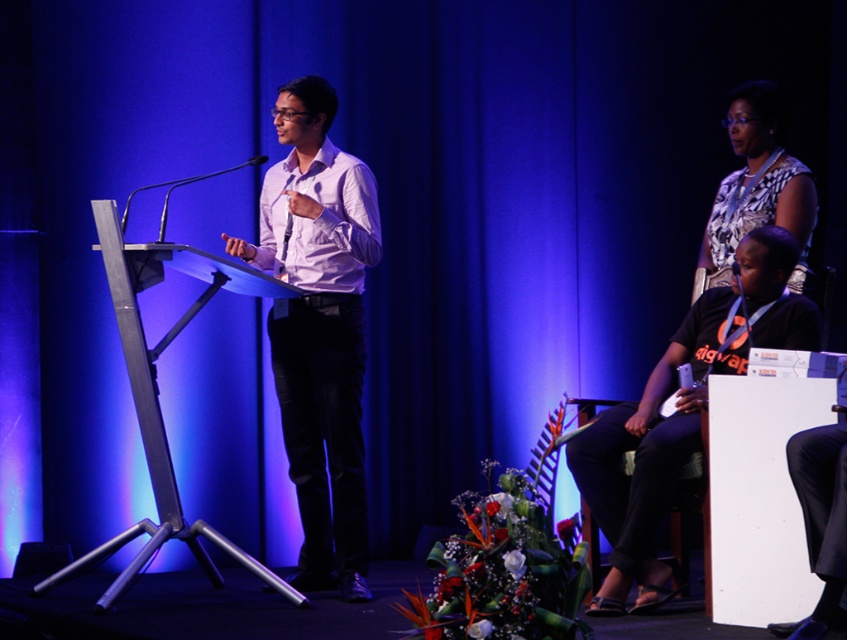
Question: Does black matte shirt at center appear over patterned fabric dress at upper right?

Choices:
 (A) yes
 (B) no

Answer: (B)

Question: Based on their relative distances, which object is nearer to the white glossy shirt at center?

Choices:
 (A) black matte shirt at center
 (B) patterned fabric dress at upper right

Answer: (A)

Question: Does black matte shirt at center come in front of patterned fabric dress at upper right?

Choices:
 (A) no
 (B) yes

Answer: (B)

Question: Among these points, which one is farthest from the camera?

Choices:
 (A) (792, 209)
 (B) (338, 461)
 (C) (729, 360)

Answer: (B)

Question: Which point is closer to the camera taking this photo?

Choices:
 (A) (609, 460)
 (B) (751, 129)
 (C) (303, 445)

Answer: (A)

Question: Does white glossy shirt at center appear over black matte shirt at center?

Choices:
 (A) no
 (B) yes

Answer: (B)